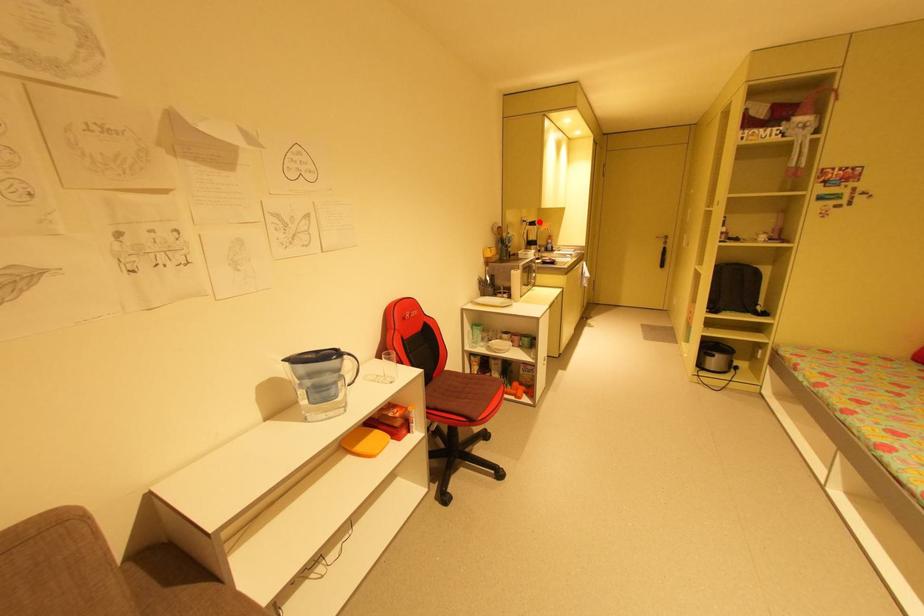
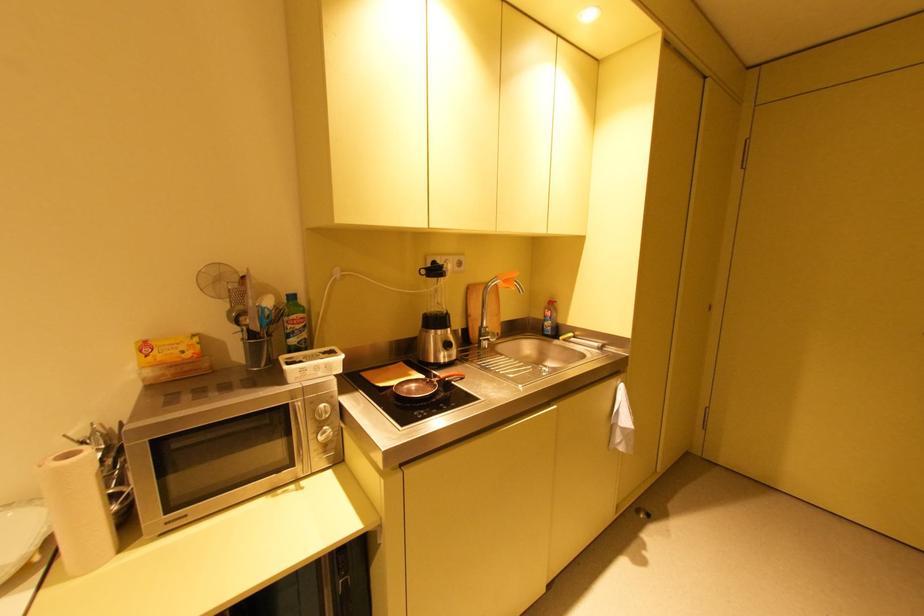
Find the pixel in the second image that matches the highlighted location in the first image.

(444, 267)